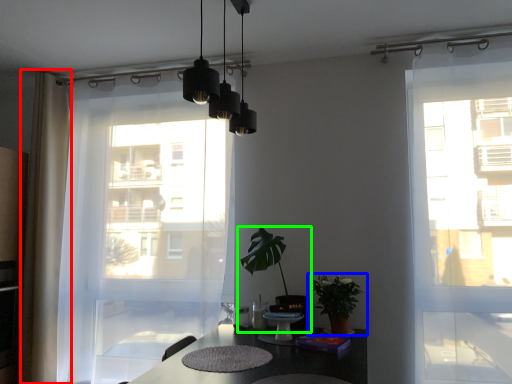
Question: Based on their relative distances, which object is farther from curtain (highlighted by a red box)? Choose from houseplant (highlighted by a blue box) and houseplant (highlighted by a green box).

Choices:
 (A) houseplant
 (B) houseplant

Answer: (A)